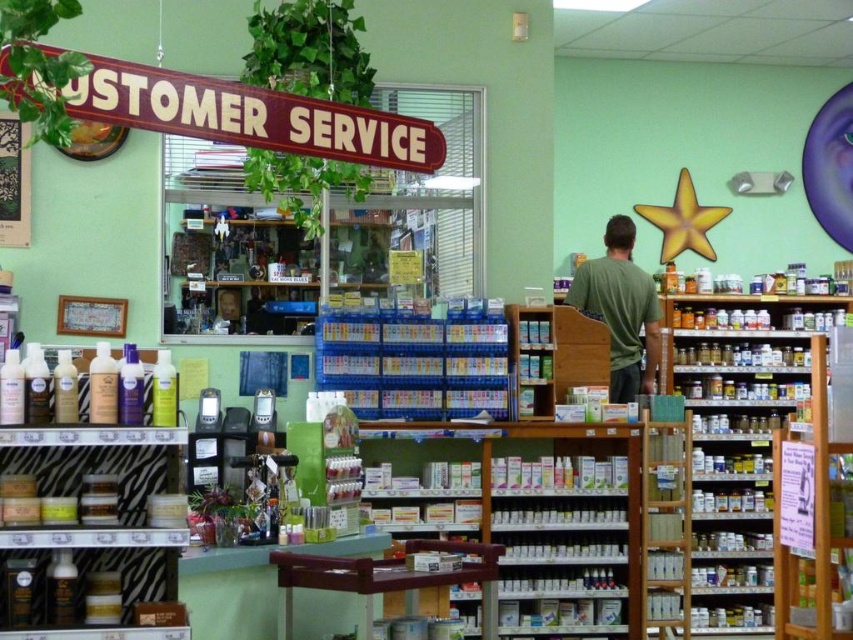
Who is positioned more to the right, zebra print containers at lower left or wooden shelf at center?

Positioned to the right is wooden shelf at center.

Is point (178, 472) positioned after point (515, 307)?

No, (178, 472) is closer to viewer.

What do you see at coordinates (90, 532) in the screenshot?
I see `zebra print containers at lower left` at bounding box center [90, 532].

Where is `zebra print containers at lower left`? zebra print containers at lower left is located at coordinates (90, 532).

Between white plastic bottles at center and wooden sign at upper left, which one appears on the right side from the viewer's perspective?

white plastic bottles at center

This screenshot has height=640, width=853. What are the coordinates of `white plastic bottles at center` in the screenshot? It's located at (566, 528).

Is point (612, 534) less distant than point (12, 218)?

No, it is not.

I want to click on white plastic bottles at center, so click(566, 528).

Does white plastic bottles at center have a greater width compared to wooden shelf at center?

Correct, the width of white plastic bottles at center exceeds that of wooden shelf at center.

Is point (630, 584) positioned in front of point (520, 310)?

That is True.

The width and height of the screenshot is (853, 640). I want to click on white plastic bottles at center, so [x=566, y=528].

Find the location of `white plastic bottles at center`. white plastic bottles at center is located at coordinates (566, 528).